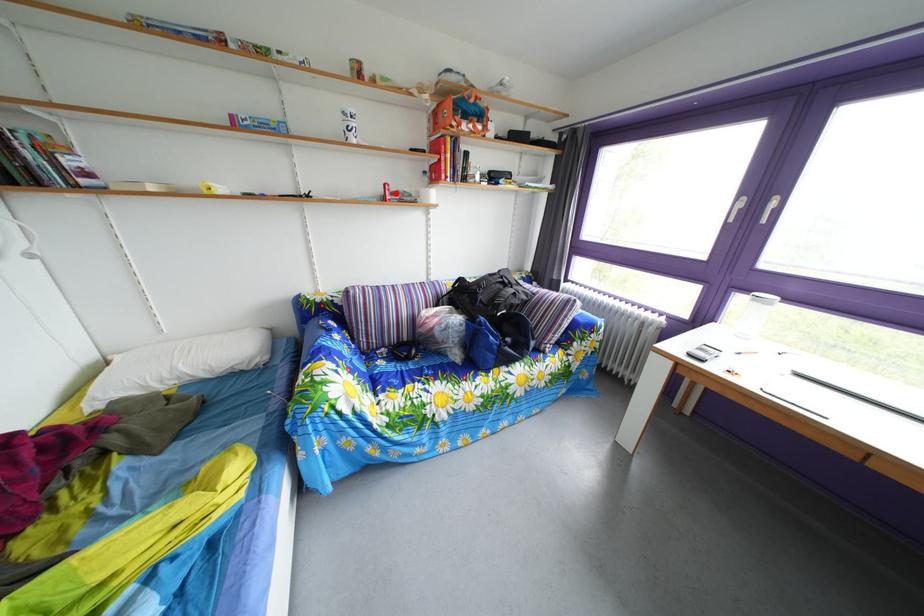
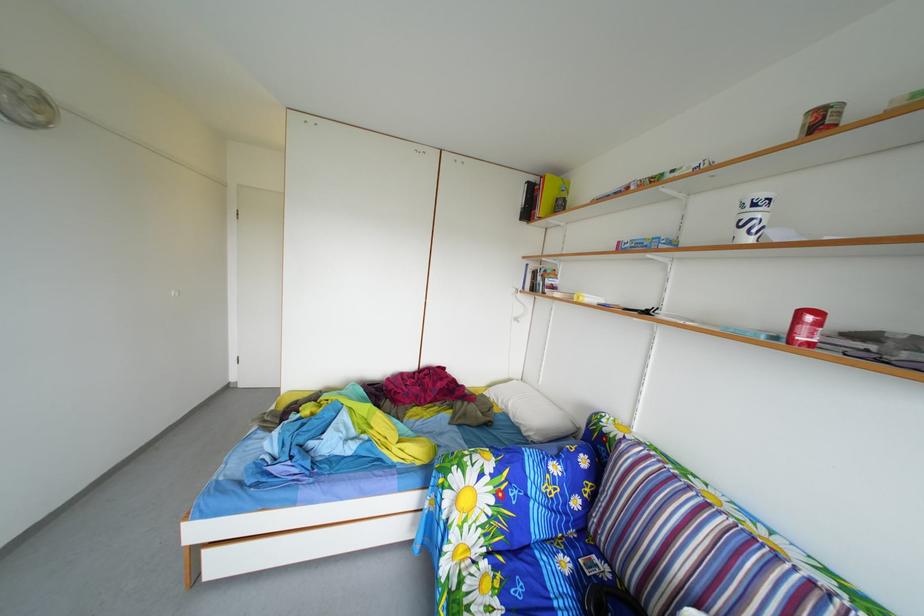
Question: A red point is marked in image1. In image2, is the corresponding 3D point closer to the camera or farther? Reply with the corresponding letter.

Choices:
 (A) The corresponding 3D point is closer.
 (B) The corresponding 3D point is farther.

Answer: (B)